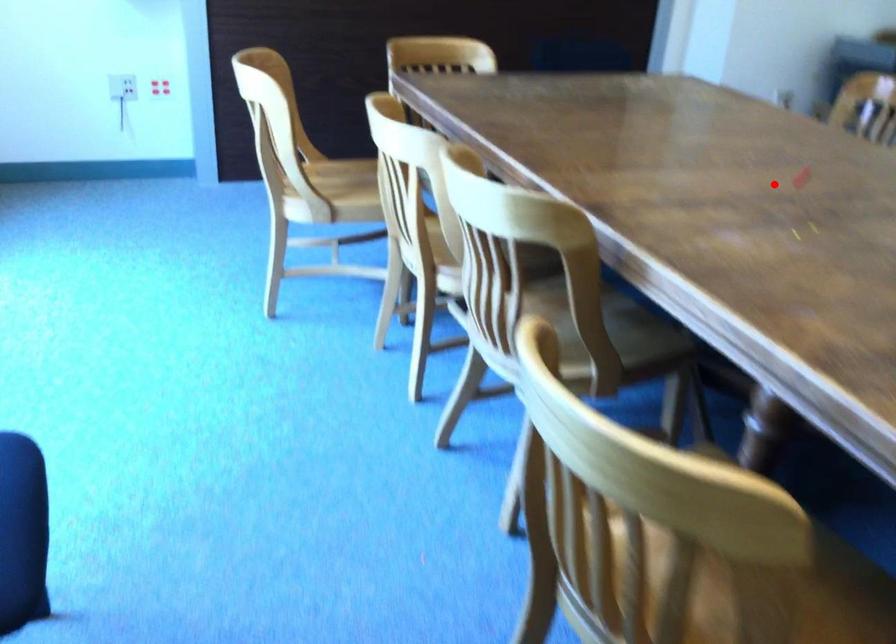
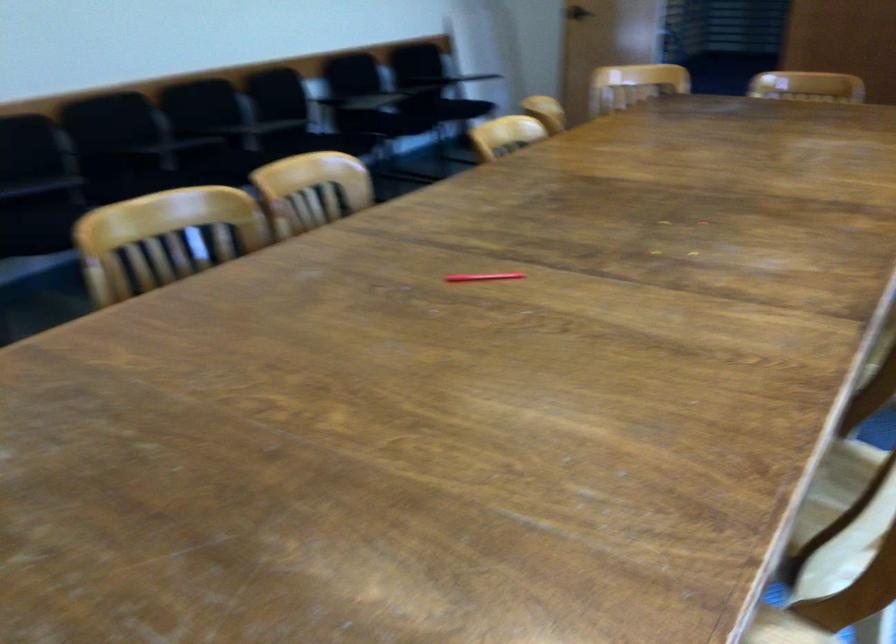
Find the pixel in the second image that matches the highlighted location in the first image.

(486, 279)